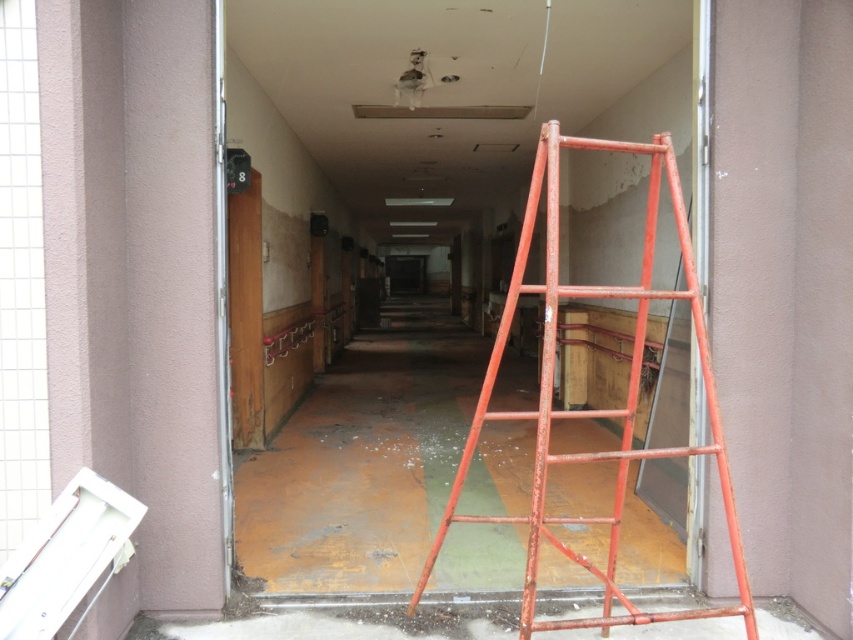
Is point (547, 387) closer to camera compared to point (242, 371)?

Yes, point (547, 387) is in front of point (242, 371).

Is rusty metal ladder at right wider than rusty metal door at left?

Indeed, rusty metal ladder at right has a greater width compared to rusty metal door at left.

Image resolution: width=853 pixels, height=640 pixels. In order to click on rusty metal ladder at right in this screenshot , I will do `click(593, 410)`.